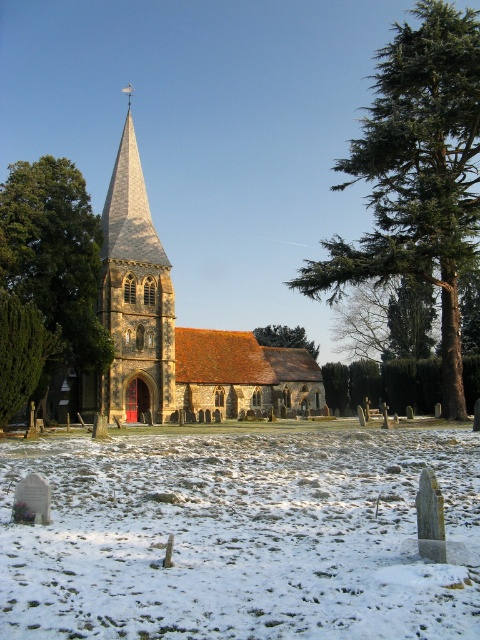
Can you confirm if green textured tree at lower left is wider than green leafy tree at center?

In fact, green textured tree at lower left might be narrower than green leafy tree at center.

Can you confirm if green textured tree at lower left is positioned to the left of green leafy tree at center?

Yes, green textured tree at lower left is to the left of green leafy tree at center.

Does point (0, 371) come in front of point (259, 342)?

Yes, it is in front of point (259, 342).

Locate an element on the screen. This screenshot has height=640, width=480. green textured tree at lower left is located at coordinates (23, 352).

Does white powdery snow at center come in front of green leafy tree at center?

Yes.

Between point (256, 604) and point (292, 332), which one is positioned behind?

Point (292, 332)

The height and width of the screenshot is (640, 480). What are the coordinates of `white powdery snow at center` in the screenshot? It's located at (240, 536).

Is the position of green textured tree at left more distant than that of green leafy tree at center?

No, it is not.

Who is lower down, green textured tree at left or green leafy tree at center?

green leafy tree at center is below.

Is point (7, 266) positioned behind point (301, 333)?

No, it is in front of (301, 333).

Find the location of a particular element. green textured tree at left is located at coordinates (47, 278).